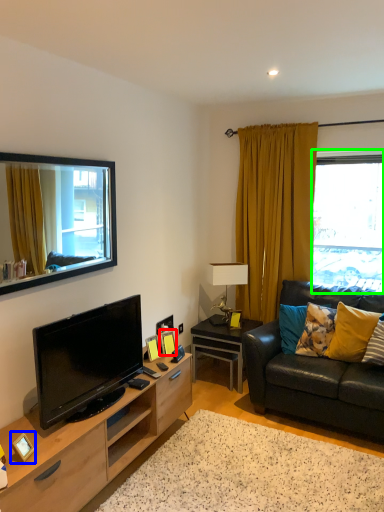
Question: Considering the real-world distances, which object is closest to picture frame (highlighted by a red box)? picture frame (highlighted by a blue box) or window (highlighted by a green box).

Choices:
 (A) picture frame
 (B) window

Answer: (A)